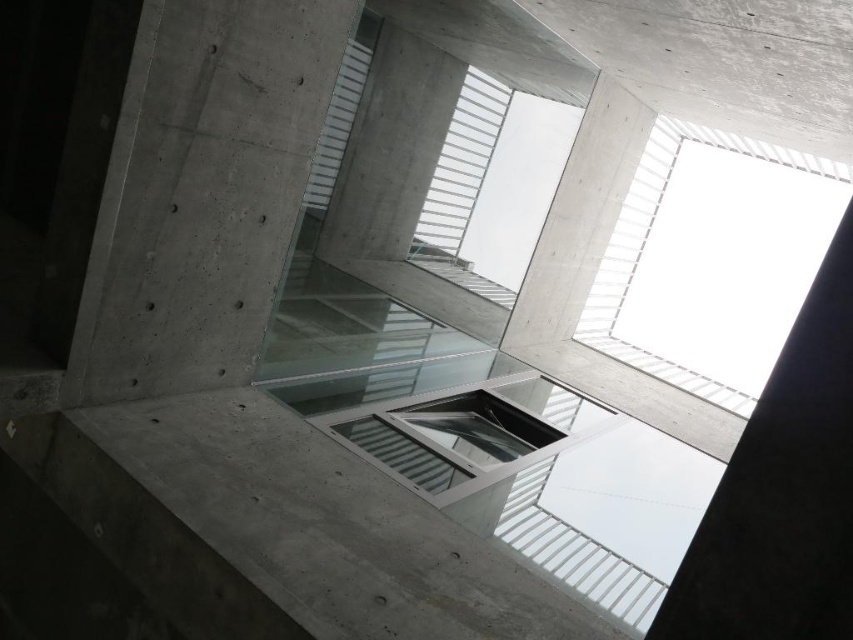
Question: Which object appears farthest from the camera in this image?

Choices:
 (A) transparent glass window at upper center
 (B) concrete at left

Answer: (A)

Question: Does concrete at left have a larger size compared to transparent glass window at upper center?

Choices:
 (A) no
 (B) yes

Answer: (B)

Question: Does concrete at left appear on the left side of transparent glass window at upper center?

Choices:
 (A) yes
 (B) no

Answer: (A)

Question: Which point appears closest to the camera in this image?

Choices:
 (A) (186, 195)
 (B) (741, 154)

Answer: (A)

Question: Which of the following is the closest to the observer?

Choices:
 (A) concrete at left
 (B) transparent glass window at upper center

Answer: (A)

Question: Is concrete at left to the right of transparent glass window at upper center from the viewer's perspective?

Choices:
 (A) no
 (B) yes

Answer: (A)